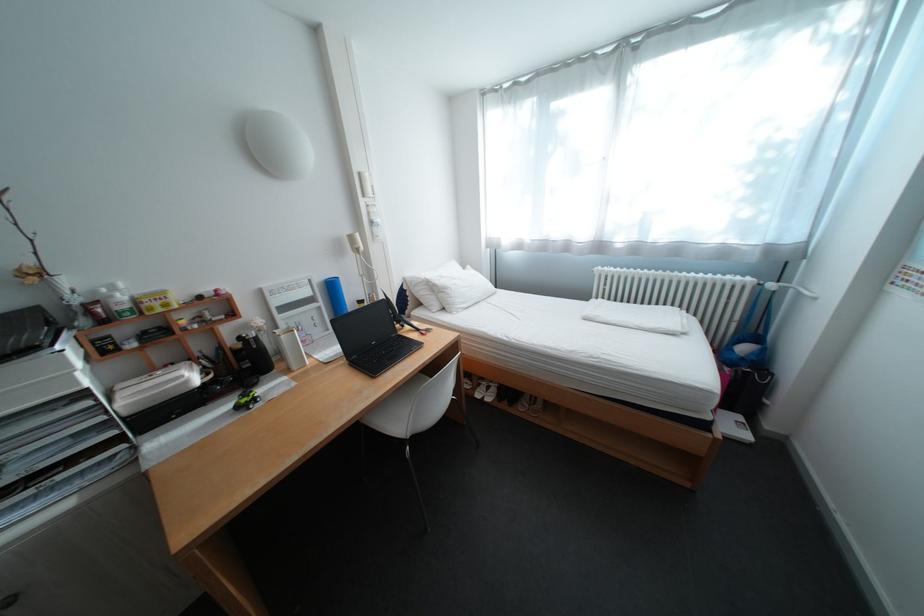
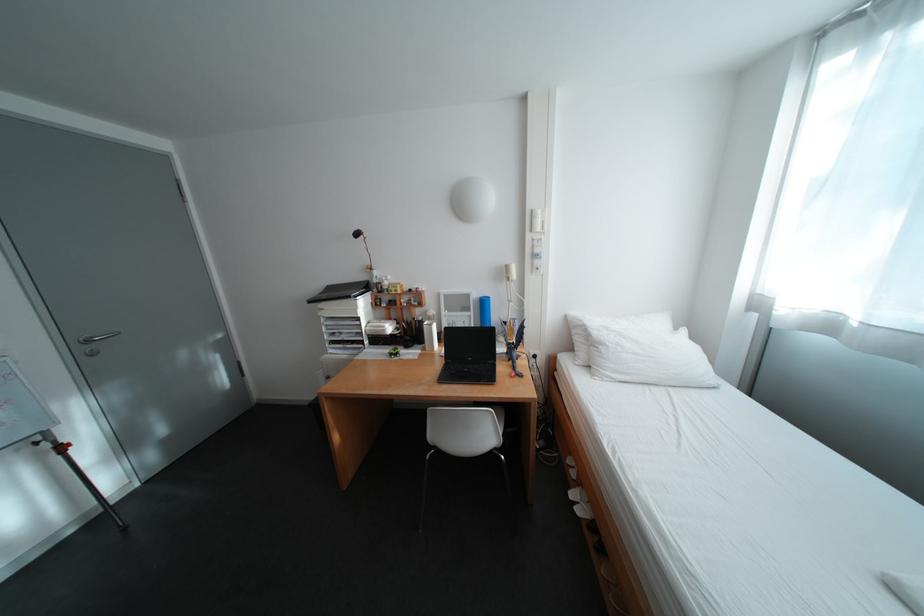
Question: The camera is either moving clockwise (left) or counter-clockwise (right) around the object. The first image is from the beginning of the video and the second image is from the end. Is the camera moving left or right when shooting the video?

Choices:
 (A) Left
 (B) Right

Answer: (B)